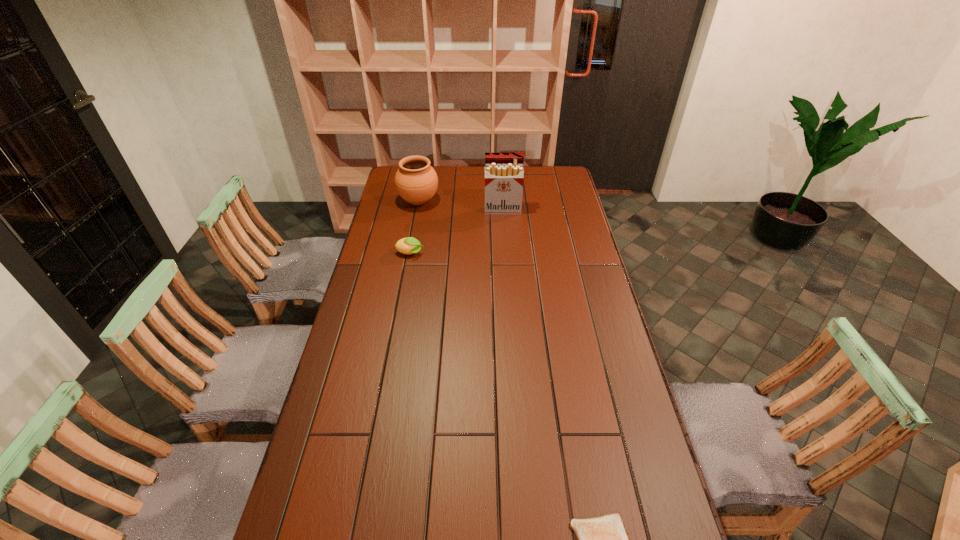
Identify the location of cigarette case. The height and width of the screenshot is (540, 960). (504, 174).

Where is `the second object from right to left`? This screenshot has height=540, width=960. the second object from right to left is located at coordinates (504, 174).

Image resolution: width=960 pixels, height=540 pixels. In order to click on the third shortest object in this screenshot , I will do `click(416, 181)`.

Where is `the third farthest object`? This screenshot has width=960, height=540. the third farthest object is located at coordinates (410, 245).

Find the location of a particular element. This screenshot has height=540, width=960. lemon is located at coordinates (410, 245).

The height and width of the screenshot is (540, 960). What are the coordinates of `vacant region located with the lid open on the tallest object` in the screenshot? It's located at (504, 237).

Identify the location of free space located on the back of the pottery. (422, 183).

You are a GUI agent. You are given a task and a screenshot of the screen. Output one action in this format:
    pyautogui.click(x=<x>, y=<y>)
    Task: Click on the vacant area situated with leaves positioned above the second shortest object
    The width and height of the screenshot is (960, 540).
    Given the screenshot: What is the action you would take?
    pyautogui.click(x=439, y=254)

Locate an element on the screen. The image size is (960, 540). pottery that is at the left edge is located at coordinates (416, 181).

I want to click on lemon present at the left edge, so click(410, 245).